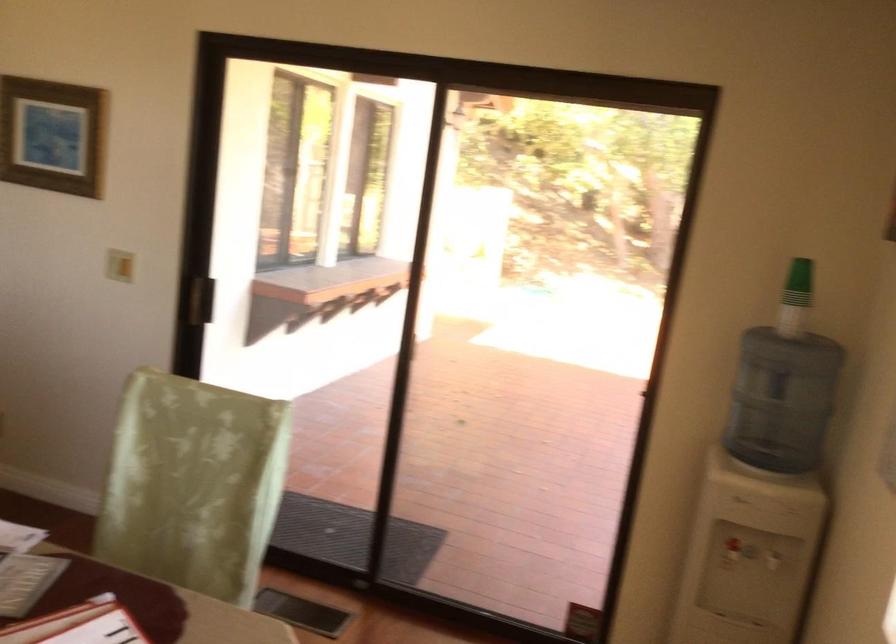
At what (x,y) coordinates should I click in order to perform the action: click on sliding door handle. Please return your answer as a coordinate pair (x, y). The width and height of the screenshot is (896, 644). Looking at the image, I should click on (201, 299).